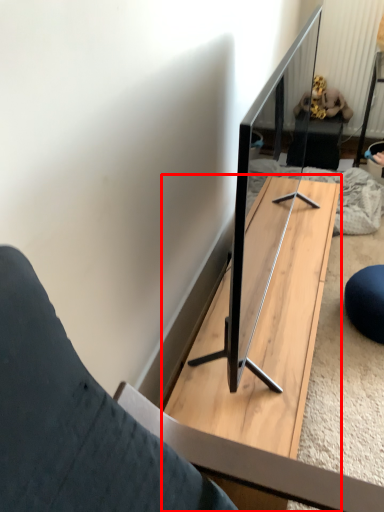
Question: From the image's perspective, considering the relative positions of table (annotated by the red box) and person in the image provided, where is table (annotated by the red box) located with respect to the staircase?

Choices:
 (A) below
 (B) above

Answer: (A)